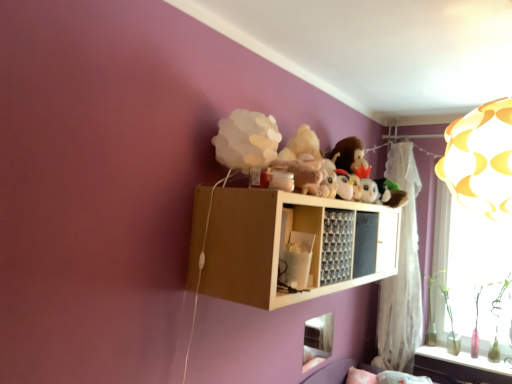
Question: Is the surface of white plush penguin at center, placed as the first toy when sorted from back to front, in direct contact with white paper lampshade at upper center, acting as the 1th toy starting from the left?

Choices:
 (A) yes
 (B) no

Answer: (B)

Question: From the image's perspective, is white plush penguin at center, placed as the second toy when sorted from front to back, below white paper lampshade at upper center, acting as the 1th toy starting from the left?

Choices:
 (A) yes
 (B) no

Answer: (A)

Question: Is white plush penguin at center, placed as the second toy when sorted from front to back, aimed at white paper lampshade at upper center, the first toy viewed from the front?

Choices:
 (A) no
 (B) yes

Answer: (A)

Question: Does white plush penguin at center, placed as the second toy when sorted from front to back, appear on the right side of white paper lampshade at upper center, acting as the 1th toy starting from the left?

Choices:
 (A) no
 (B) yes

Answer: (B)

Question: From the image's perspective, is white plush penguin at center, the first toy when ordered from right to left, over white paper lampshade at upper center, the first toy viewed from the front?

Choices:
 (A) yes
 (B) no

Answer: (B)

Question: From the image's perspective, relative to white plush penguin at center, placed as the second toy when sorted from front to back, is wooden shelf at upper center above or below?

Choices:
 (A) above
 (B) below

Answer: (B)

Question: In terms of height, does wooden shelf at upper center look taller or shorter compared to white plush penguin at center, arranged as the second toy when viewed from the left?

Choices:
 (A) tall
 (B) short

Answer: (A)

Question: Considering their positions, is wooden shelf at upper center located in front of or behind white plush penguin at center, the first toy when ordered from right to left?

Choices:
 (A) behind
 (B) front

Answer: (B)

Question: Is wooden shelf at upper center to the left or to the right of white plush penguin at center, the first toy when ordered from right to left, in the image?

Choices:
 (A) left
 (B) right

Answer: (A)

Question: Relative to white sheer curtain at upper right, is wooden shelf at upper center in front or behind?

Choices:
 (A) front
 (B) behind

Answer: (A)

Question: Is point (233, 215) closer or farther from the camera than point (406, 284)?

Choices:
 (A) farther
 (B) closer

Answer: (B)

Question: From the image's perspective, relative to white sheer curtain at upper right, is wooden shelf at upper center above or below?

Choices:
 (A) above
 (B) below

Answer: (A)

Question: From a real-world perspective, relative to white sheer curtain at upper right, is wooden shelf at upper center vertically above or below?

Choices:
 (A) above
 (B) below

Answer: (A)

Question: Is white paper lampshade at upper center, the first toy viewed from the front, inside or outside of wooden shelf at upper center?

Choices:
 (A) inside
 (B) outside

Answer: (B)

Question: Considering the positions of white paper lampshade at upper center, acting as the 2th toy starting from the back, and wooden shelf at upper center in the image, is white paper lampshade at upper center, acting as the 2th toy starting from the back, taller or shorter than wooden shelf at upper center?

Choices:
 (A) short
 (B) tall

Answer: (A)